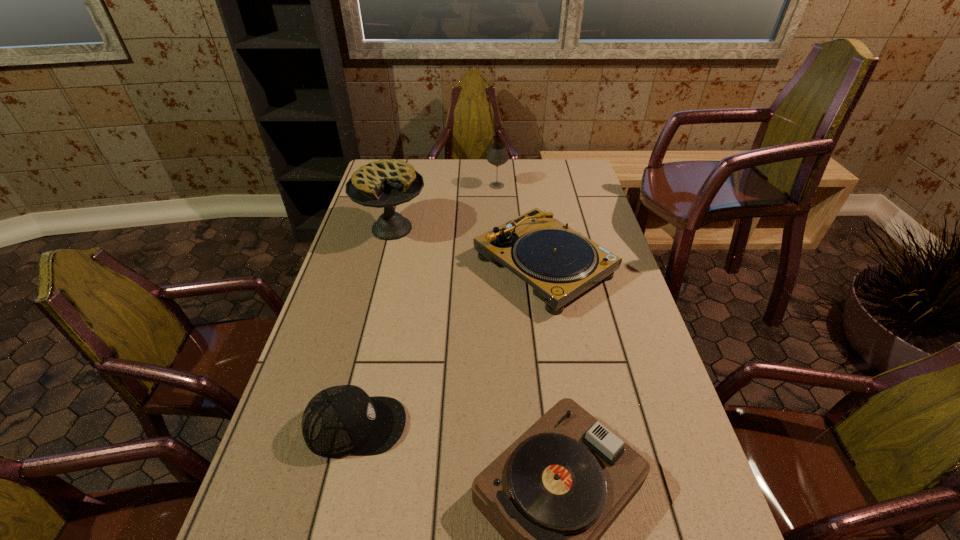
This screenshot has width=960, height=540. I want to click on pie, so click(x=385, y=183).

You are a GUI agent. You are given a task and a screenshot of the screen. Output one action in this format:
    pyautogui.click(x=<x>, y=<y>)
    Task: Click on the farthest object
    This screenshot has width=960, height=540.
    Given the screenshot: What is the action you would take?
    pos(497,155)

The width and height of the screenshot is (960, 540). I want to click on wineglass, so pos(497,155).

You are a GUI agent. You are given a task and a screenshot of the screen. Output one action in this format:
    pyautogui.click(x=<x>, y=<y>)
    Task: Click on the farther record player
    Image resolution: width=960 pixels, height=540 pixels.
    Given the screenshot: What is the action you would take?
    pyautogui.click(x=559, y=263)

I want to click on cap, so click(x=338, y=421).

This screenshot has width=960, height=540. I want to click on vacant space located on the cut side of the tallest object, so click(372, 304).

At what (x,y) coordinates should I click in order to perform the action: click on blank space located on the front of the wineglass. Please return your answer as a coordinate pair (x, y). The image size is (960, 540). Looking at the image, I should click on (497, 199).

At what (x,y) coordinates should I click in order to perform the action: click on vacant position located 0.400m on the front of the farther record player. Please return your answer as a coordinate pair (x, y). The height and width of the screenshot is (540, 960). Looking at the image, I should click on (575, 454).

Identify the location of free space located on the front-facing side of the cap. (454, 426).

Where is `object located in the far edge section of the desktop`? This screenshot has height=540, width=960. object located in the far edge section of the desktop is located at coordinates (497, 155).